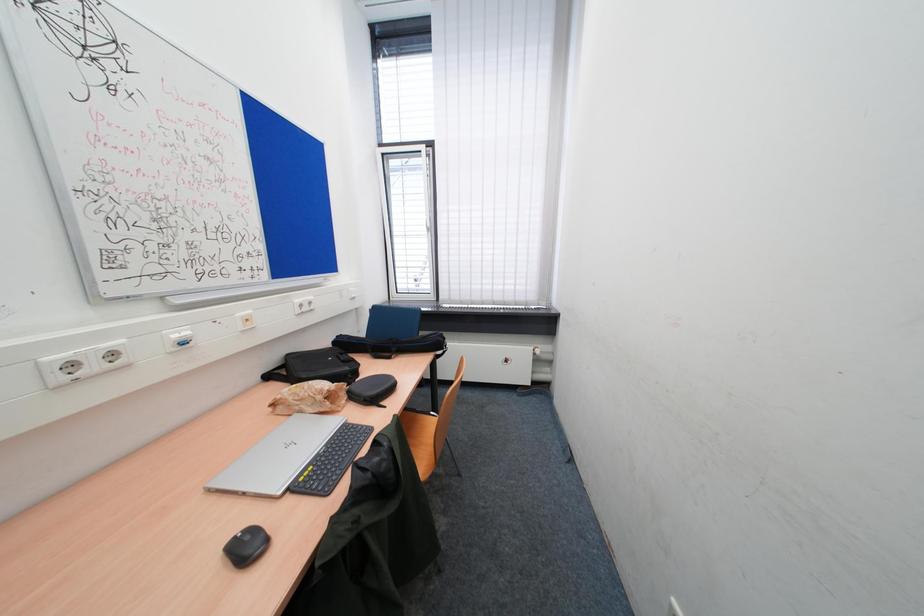
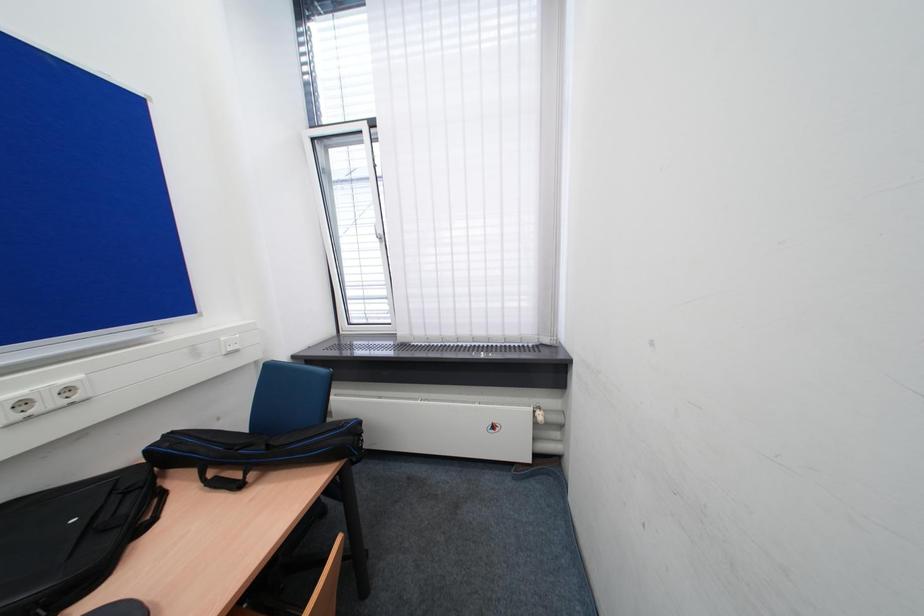
Question: The images are taken continuously from a first-person perspective. In which direction is your viewpoint rotating?

Choices:
 (A) Left
 (B) Right
 (C) Up
 (D) Down

Answer: (C)